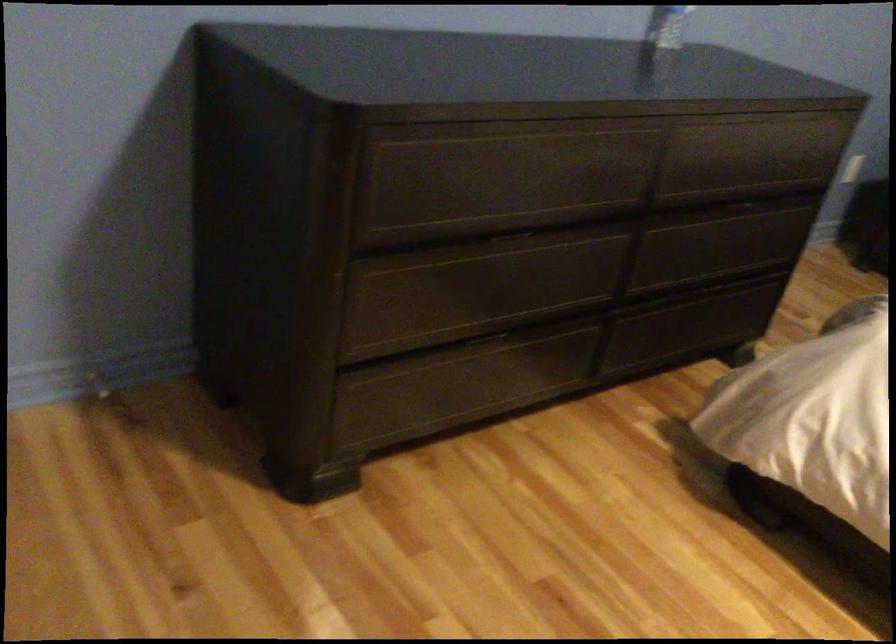
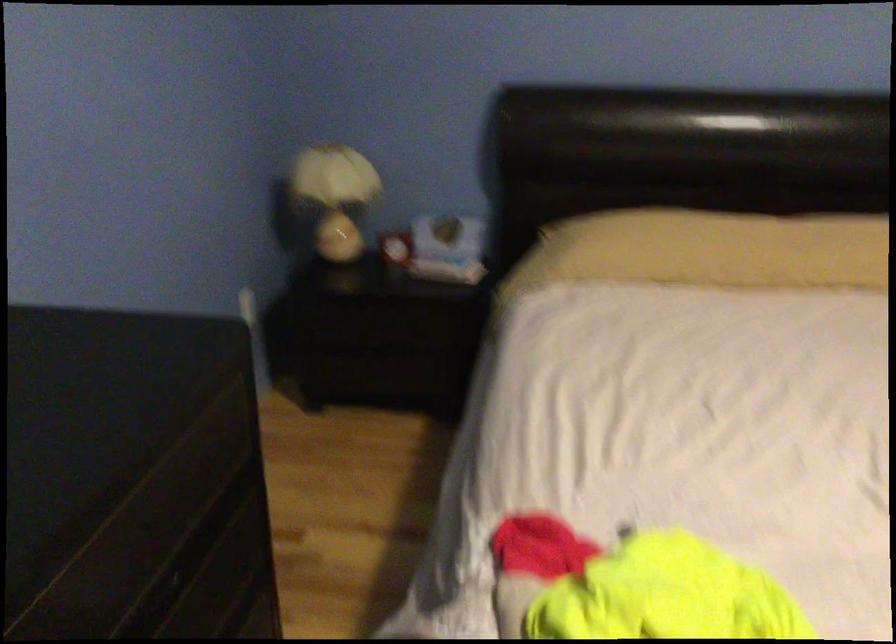
Find the pixel in the second image that matches [780,190] in the first image.

(186, 559)